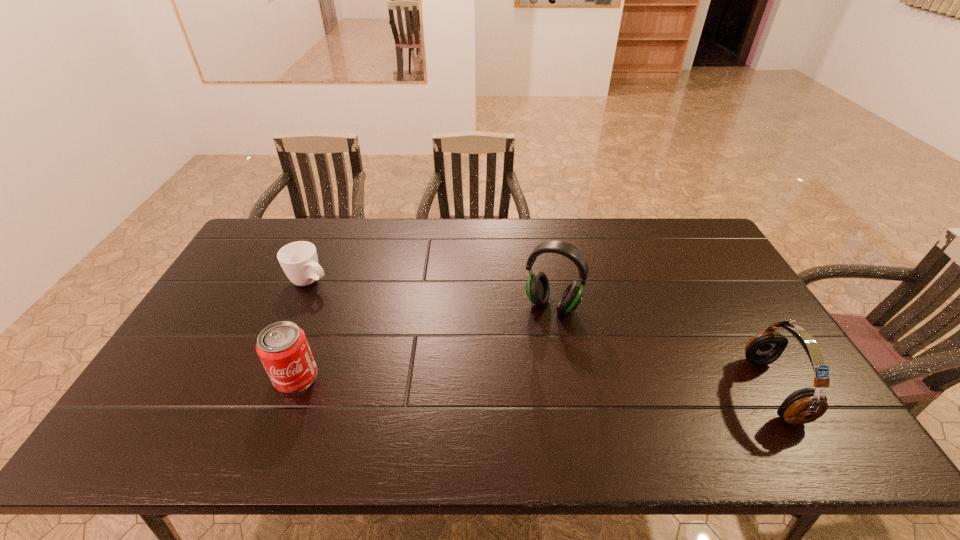
Locate an element on the screen. This screenshot has width=960, height=540. vacant space at the near right corner is located at coordinates (772, 411).

Where is `free space between the taller headset and the shortest object`? The height and width of the screenshot is (540, 960). free space between the taller headset and the shortest object is located at coordinates (431, 293).

Where is `free point between the can and the cup`? free point between the can and the cup is located at coordinates (303, 329).

Image resolution: width=960 pixels, height=540 pixels. Identify the location of empty location between the nearer headset and the can. (535, 383).

Where is `free space between the second shortest object and the cup`? This screenshot has height=540, width=960. free space between the second shortest object and the cup is located at coordinates (303, 329).

Locate an element on the screen. Image resolution: width=960 pixels, height=540 pixels. free point between the third tallest object and the second tallest object is located at coordinates (535, 383).

The image size is (960, 540). I want to click on empty location between the shortest object and the second tallest object, so click(541, 335).

At what (x,y) coordinates should I click in order to perform the action: click on vacant space that's between the cup and the nearer headset. Please return your answer as a coordinate pair (x, y). Image resolution: width=960 pixels, height=540 pixels. Looking at the image, I should click on (541, 335).

This screenshot has width=960, height=540. In order to click on vacant point located between the tallest object and the shortest object in this screenshot , I will do `click(431, 293)`.

At what (x,y) coordinates should I click in order to perform the action: click on vacant space in between the shorter headset and the shortest object. Please return your answer as a coordinate pair (x, y). The image size is (960, 540). Looking at the image, I should click on (541, 335).